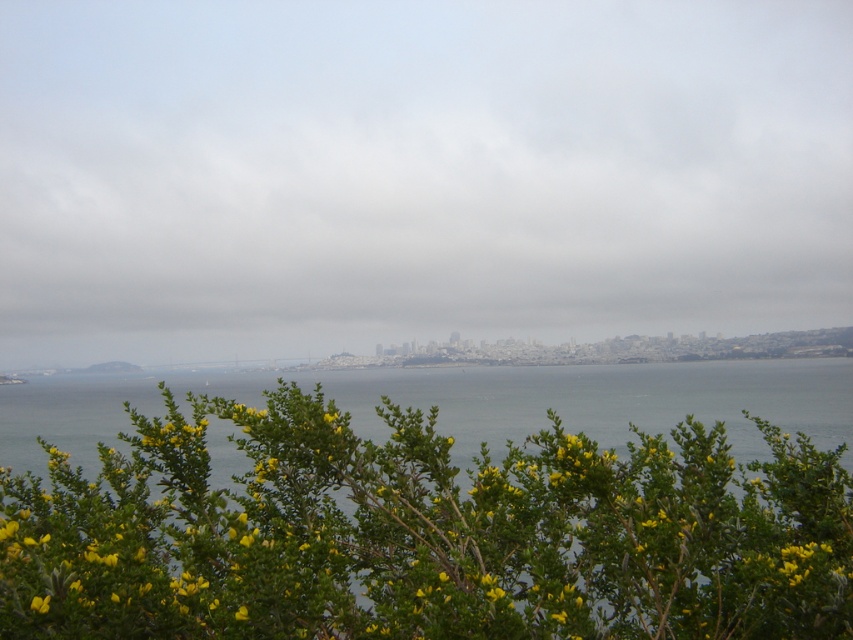
You are a photographer planning to capture the entire scene from your current position. Given that the transparent water at center and the green leafy bush at lower center are both in view, which object will appear taller in the photograph?

The transparent water at center will appear taller in the photograph since it has a greater height compared to the green leafy bush at lower center according to the description.

You are a drone operator trying to capture a photo of the transparent water at center. The drone is currently at the point with coordinates point (416, 173). Can you confirm if the drone is positioned over the transparent water at center?

The point (416, 173) indicates transparent water at center, so yes, the drone is positioned over the transparent water at center.

In the scene shown: You are a photographer trying to capture the city skyline in the background. You notice the transparent water at center and the green leafy bush at lower center. Which object should you move closer to in order to ensure the city skyline is clearly visible in your photo?

You should move closer to the transparent water at center because the green leafy bush at lower center is behind it, so moving closer to the water will allow a clearer view of the city skyline beyond.